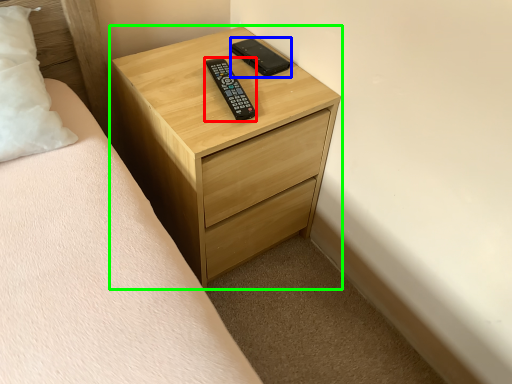
Question: Based on their relative distances, which object is nearer to control (highlighted by a red box)? Choose from control (highlighted by a blue box) and chest of drawers (highlighted by a green box).

Choices:
 (A) control
 (B) chest of drawers

Answer: (A)